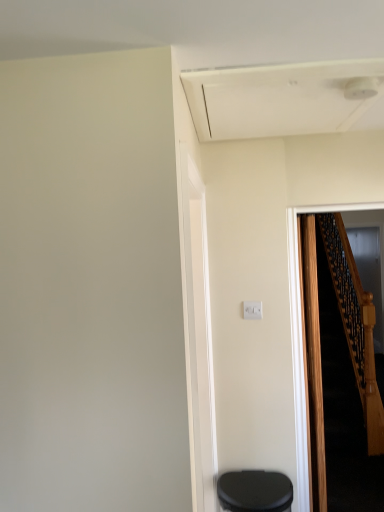
Question: Can you confirm if transparent glass door at right is thinner than white plastic electric outlet at center?

Choices:
 (A) yes
 (B) no

Answer: (B)

Question: Can you confirm if transparent glass door at right is taller than white plastic electric outlet at center?

Choices:
 (A) yes
 (B) no

Answer: (A)

Question: From the image's perspective, is transparent glass door at right on top of white plastic electric outlet at center?

Choices:
 (A) yes
 (B) no

Answer: (B)

Question: Is transparent glass door at right closer to the viewer compared to white plastic electric outlet at center?

Choices:
 (A) yes
 (B) no

Answer: (B)

Question: From a real-world perspective, is transparent glass door at right positioned under white plastic electric outlet at center based on gravity?

Choices:
 (A) yes
 (B) no

Answer: (A)

Question: Can you confirm if transparent glass door at right is positioned to the right of white plastic electric outlet at center?

Choices:
 (A) yes
 (B) no

Answer: (A)

Question: From the image's perspective, is black matte trash can at lower right on transparent glass door at right?

Choices:
 (A) yes
 (B) no

Answer: (B)

Question: Considering the relative sizes of black matte trash can at lower right and transparent glass door at right in the image provided, is black matte trash can at lower right shorter than transparent glass door at right?

Choices:
 (A) yes
 (B) no

Answer: (A)

Question: Is transparent glass door at right completely or partially inside black matte trash can at lower right?

Choices:
 (A) no
 (B) yes

Answer: (A)

Question: Is black matte trash can at lower right turned away from transparent glass door at right?

Choices:
 (A) yes
 (B) no

Answer: (A)

Question: Does black matte trash can at lower right have a larger size compared to transparent glass door at right?

Choices:
 (A) yes
 (B) no

Answer: (B)

Question: From a real-world perspective, does black matte trash can at lower right stand above transparent glass door at right?

Choices:
 (A) yes
 (B) no

Answer: (B)

Question: Is wooden at right wider than white plastic electric outlet at center?

Choices:
 (A) yes
 (B) no

Answer: (A)